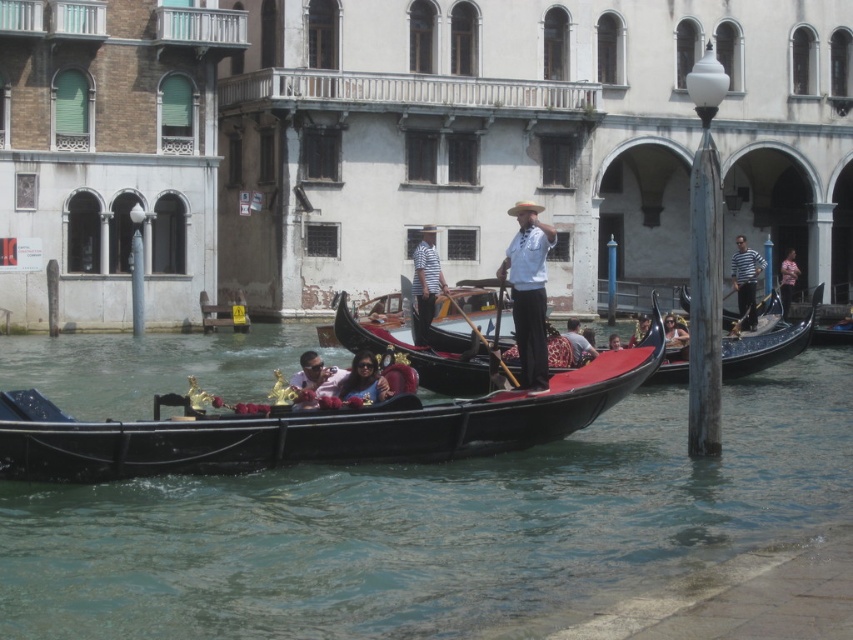
Which of these two, shiny black gondola at center or matte black sunglasses at center, stands shorter?

Standing shorter between the two is matte black sunglasses at center.

What do you see at coordinates (311, 428) in the screenshot? I see `shiny black gondola at center` at bounding box center [311, 428].

This screenshot has width=853, height=640. What do you see at coordinates (311, 428) in the screenshot?
I see `shiny black gondola at center` at bounding box center [311, 428].

Locate an element on the screen. The height and width of the screenshot is (640, 853). shiny black gondola at center is located at coordinates (311, 428).

Between point (521, 289) and point (750, 328), which one is positioned behind?

The point (750, 328) is behind.

Image resolution: width=853 pixels, height=640 pixels. Identify the location of white cotton shirt at center. (529, 291).

Image resolution: width=853 pixels, height=640 pixels. What are the coordinates of `white cotton shirt at center` in the screenshot? It's located at (529, 291).

Which is more to the right, black polished wood gondola at center or black polished gondola at center?

black polished gondola at center

Is point (103, 353) closer to viewer compared to point (734, 349)?

That is False.

Measure the distance between black polished wood gondola at center and camera.

16.53 meters

Find the location of `black polished wood gondola at center`. black polished wood gondola at center is located at coordinates (432, 525).